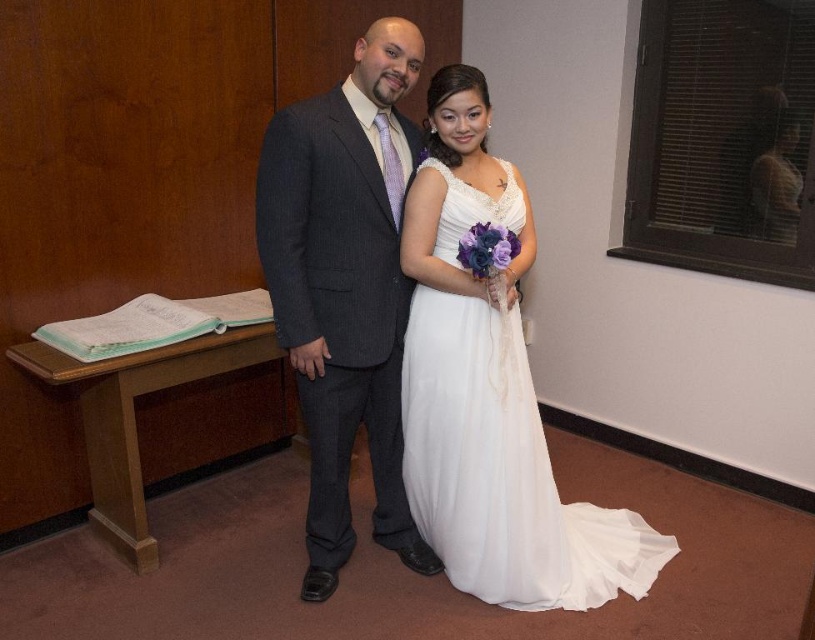
You are a photographer at a wedding venue and need to position two dresses for a photo shoot. The white satin dress at center and the white chiffon dress at center are both placed at the center of the venue. Which dress is positioned to the left when viewed from the front?

The white satin dress at center is positioned to the left of the white chiffon dress at center when viewed from the front.

You are a photographer at a wedding venue and need to capture the couple in their dresses. The white satin dress at center and the white chiffon dress at center are both in the same location. Which dress is closer to the camera?

The white satin dress at center is positioned under the white chiffon dress at center, so the white chiffon dress at center is closer to the camera.